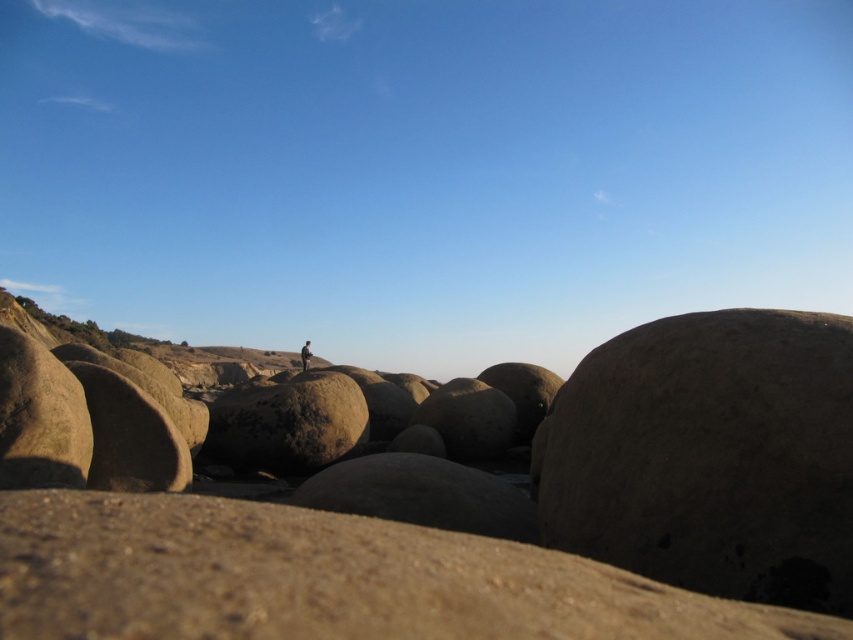
This screenshot has width=853, height=640. What do you see at coordinates (450, 508) in the screenshot? I see `smooth sandstone rocks at center` at bounding box center [450, 508].

Does smooth sandstone rocks at center have a greater width compared to brown rough boulder at right?

No.

Identify the location of smooth sandstone rocks at center. (450, 508).

Which is below, brown rough boulder at right or brown textured jacket at center?

brown textured jacket at center is below.

Describe the element at coordinates (711, 456) in the screenshot. This screenshot has width=853, height=640. I see `brown rough boulder at right` at that location.

Who is more forward, [656,540] or [308,355]?

Point [656,540] is in front.

Locate an element on the screen. The height and width of the screenshot is (640, 853). brown rough boulder at right is located at coordinates (711, 456).

Does smooth beige sand at lower center have a lesser width compared to brown textured jacket at center?

Correct, smooth beige sand at lower center's width is less than brown textured jacket at center's.

Does point (163, 595) lie behind point (303, 362)?

No, it is in front of (303, 362).

Find the location of a particular element. The image size is (853, 640). smooth beige sand at lower center is located at coordinates (323, 579).